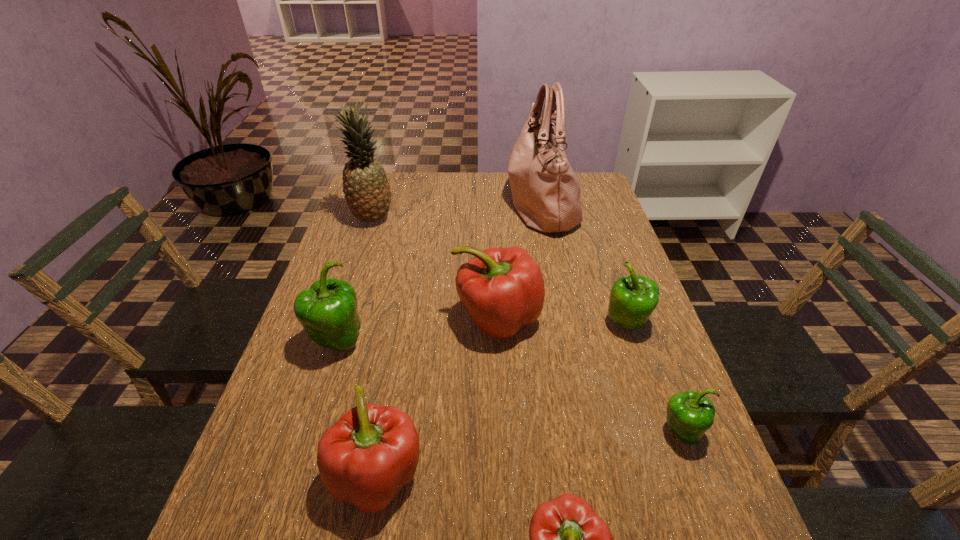
Find the location of `vacant space positioned 0.230m on the back of the pineapple`. vacant space positioned 0.230m on the back of the pineapple is located at coordinates (387, 174).

Identify the location of vacant region located on the right of the leftmost green bell pepper. (387, 342).

Where is `free location located 0.140m on the right of the farthest pink bell pepper`? free location located 0.140m on the right of the farthest pink bell pepper is located at coordinates (597, 319).

Image resolution: width=960 pixels, height=540 pixels. What are the coordinates of `vacant space situated 0.340m on the left of the second smallest green bell pepper` in the screenshot? It's located at (468, 325).

Image resolution: width=960 pixels, height=540 pixels. In order to click on blank space located 0.270m on the back of the second smallest pink bell pepper in this screenshot , I will do `click(402, 330)`.

Find the location of a particular element. This screenshot has height=540, width=960. vacant space located on the back of the nearest green bell pepper is located at coordinates (644, 334).

The width and height of the screenshot is (960, 540). In order to click on object present at the far edge in this screenshot , I will do `click(546, 193)`.

Where is `pineapple that is at the left edge`? The height and width of the screenshot is (540, 960). pineapple that is at the left edge is located at coordinates (367, 191).

Where is `handbag situated at the right edge`? handbag situated at the right edge is located at coordinates click(x=546, y=193).

The height and width of the screenshot is (540, 960). In order to click on object present at the far right corner in this screenshot , I will do 546,193.